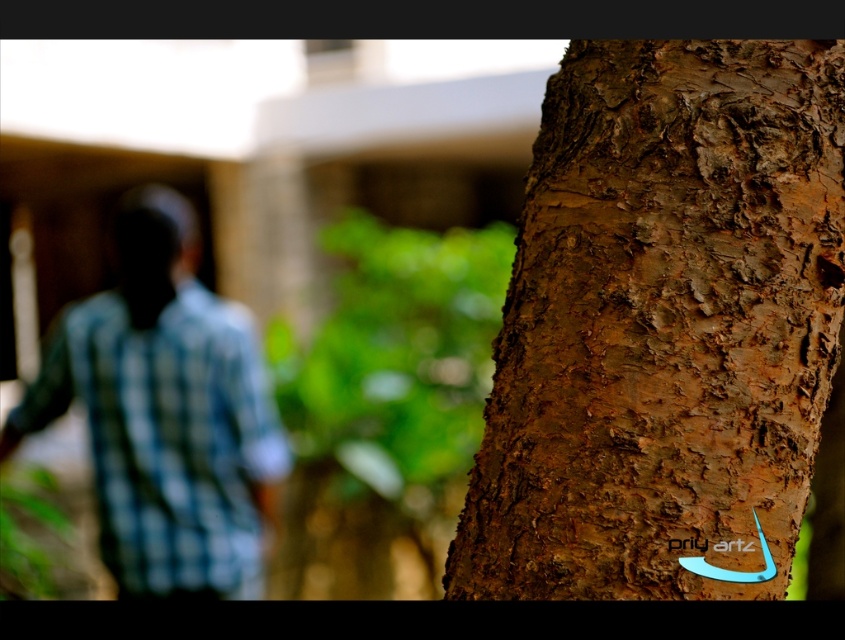
Is the position of brown rough bark at right less distant than that of blue checkered shirt at left?

Yes, brown rough bark at right is in front of blue checkered shirt at left.

Is point (608, 305) behind point (139, 458)?

No.

Where is `brown rough bark at right`? The image size is (845, 640). brown rough bark at right is located at coordinates (663, 326).